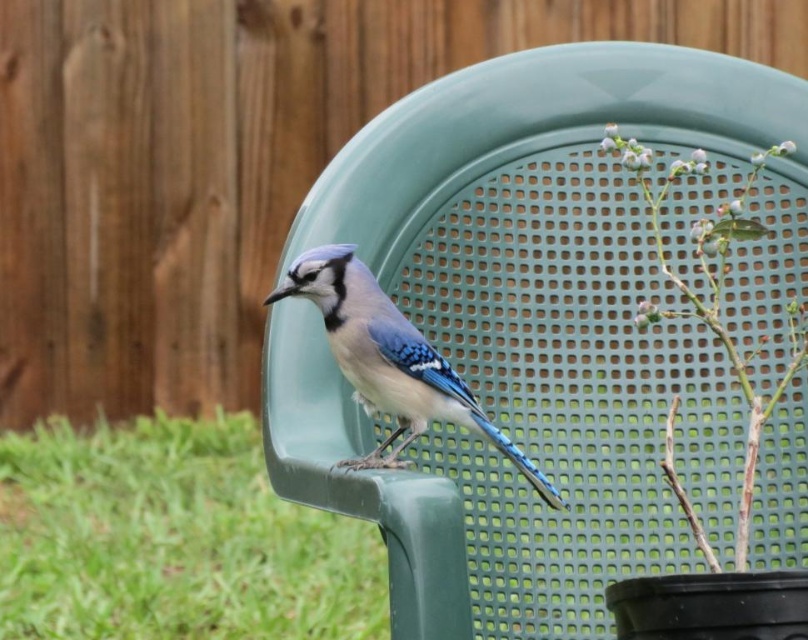
You are standing in the backyard and want to place a small decoration between the two points, point 1 at point (344,252) and point 2 at point (747,512). Which point is closer to you so you can start placing the decoration there?

Point (344,252) is closer to you than point (747,512), so you should start placing the decoration near point (344,252) first.

You are a photographer trying to capture the blue glossy bird at center. You notice the green plastic chair at center is blocking your view. Is the bird positioned in front of or behind the chair?

The blue glossy bird at center is behind the green plastic chair at center, so it is positioned behind the chair.